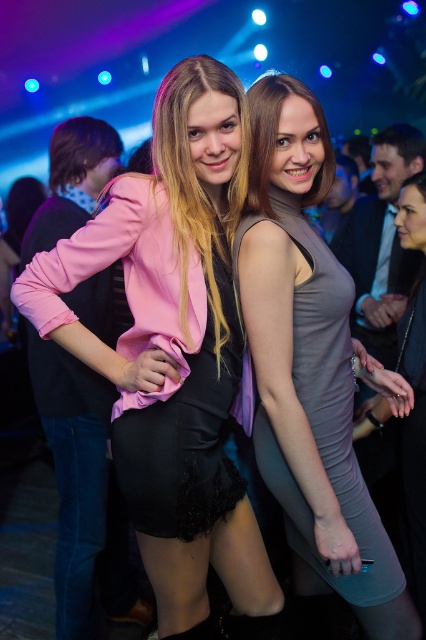
Is pink satin dress at center below satin gray dress at center?

Correct, pink satin dress at center is located below satin gray dress at center.

Is point (167, 116) positioned before point (322, 401)?

Yes, it is.

The height and width of the screenshot is (640, 426). Identify the location of pink satin dress at center. point(173,346).